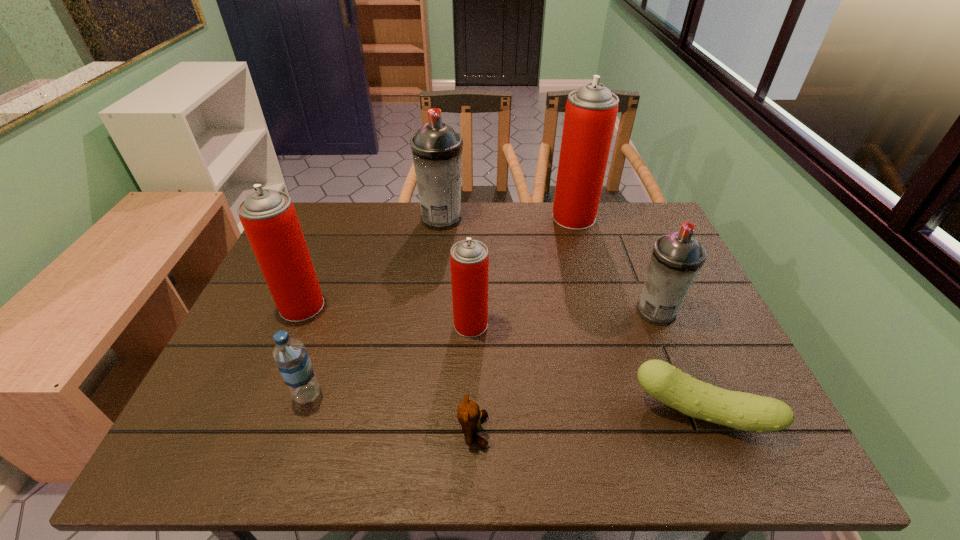
Find the location of `vacant space at the right edge of the desktop`. vacant space at the right edge of the desktop is located at coordinates pos(708,310).

This screenshot has width=960, height=540. What are the coordinates of `vacant region at the near left corner of the desktop` in the screenshot? It's located at (197, 450).

Where is `vacant space at the far right corner of the desktop`? Image resolution: width=960 pixels, height=540 pixels. vacant space at the far right corner of the desktop is located at coordinates (620, 211).

Where is `vacant area at the near right corner`? The image size is (960, 540). vacant area at the near right corner is located at coordinates (726, 454).

This screenshot has height=540, width=960. I want to click on blank region between the farther gray aerosol can and the second smallest red aerosol can, so click(372, 262).

The height and width of the screenshot is (540, 960). In order to click on free space between the water bottle and the brown teddy bear in this screenshot , I will do `click(391, 413)`.

Find the location of `free space between the second red aerosol can from left to right and the rightmost aerosol can`. free space between the second red aerosol can from left to right and the rightmost aerosol can is located at coordinates click(564, 318).

Where is `free space between the green cucumber and the water bottle`? This screenshot has width=960, height=540. free space between the green cucumber and the water bottle is located at coordinates (504, 403).

This screenshot has height=540, width=960. I want to click on unoccupied position between the rightmost aerosol can and the farthest red aerosol can, so click(615, 265).

The height and width of the screenshot is (540, 960). In order to click on free space between the smallest red aerosol can and the leftmost red aerosol can in this screenshot , I will do `click(386, 315)`.